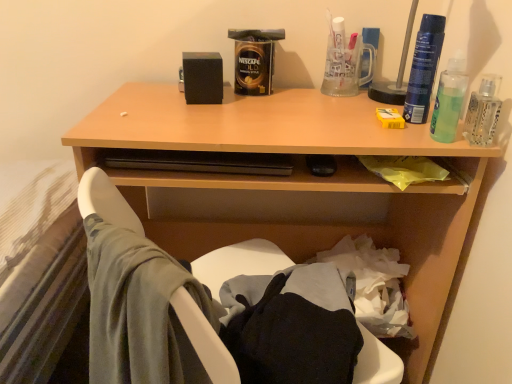
Describe the element at coordinates (292, 183) in the screenshot. I see `wooden desk at upper center` at that location.

This screenshot has width=512, height=384. What do you see at coordinates (449, 100) in the screenshot?
I see `green translucent liquid at upper right` at bounding box center [449, 100].

You are a GUI agent. You are given a task and a screenshot of the screen. Output one action in this format:
    pyautogui.click(x=<x>, y=<y>)
    Task: Click on the blue plastic spray can at upper right, acting as the second bottle starting from the right
    Image resolution: width=512 pixels, height=384 pixels.
    Given the screenshot: What is the action you would take?
    pyautogui.click(x=424, y=68)

I want to click on clear glass bottle at upper right, which appears as the 2th bottle when viewed from the left, so click(483, 112).

Locate an element on the screen. This screenshot has height=384, width=512. wooden desk at upper center is located at coordinates (292, 183).

Is clear glass bottle at upper right, which appears as the 2th bottle when viewed from the left, not inside wooden desk at upper center?

Indeed, clear glass bottle at upper right, which appears as the 2th bottle when viewed from the left, is completely outside wooden desk at upper center.

From a real-world perspective, which is physically above, clear glass bottle at upper right, which appears as the 2th bottle when viewed from the left, or wooden desk at upper center?

clear glass bottle at upper right, which appears as the 2th bottle when viewed from the left.

Considering the sizes of objects clear glass bottle at upper right, which appears as the 2th bottle when viewed from the left, and wooden desk at upper center in the image provided, who is smaller, clear glass bottle at upper right, which appears as the 2th bottle when viewed from the left, or wooden desk at upper center?

With smaller size is clear glass bottle at upper right, which appears as the 2th bottle when viewed from the left.

Between clear glass bottle at upper right, which appears as the 2th bottle when viewed from the left, and wooden desk at upper center, which one appears on the left side from the viewer's perspective?

wooden desk at upper center is more to the left.

Is the surface of clear glass bottle at upper right, which appears as the 2th bottle when viewed from the left, in direct contact with green translucent liquid at upper right?

Yes, clear glass bottle at upper right, which appears as the 2th bottle when viewed from the left, is with green translucent liquid at upper right.

Between clear glass bottle at upper right, which appears as the 2th bottle when viewed from the left, and green translucent liquid at upper right, which one has smaller size?

clear glass bottle at upper right, which appears as the 2th bottle when viewed from the left.

Is clear glass bottle at upper right, the first bottle in the right-to-left sequence, wider than green translucent liquid at upper right?

In fact, clear glass bottle at upper right, the first bottle in the right-to-left sequence, might be narrower than green translucent liquid at upper right.

Considering the relative sizes of clear glass bottle at upper right, the first bottle in the right-to-left sequence, and green translucent liquid at upper right in the image provided, is clear glass bottle at upper right, the first bottle in the right-to-left sequence, taller than green translucent liquid at upper right?

→ In fact, clear glass bottle at upper right, the first bottle in the right-to-left sequence, may be shorter than green translucent liquid at upper right.

Where is `desk on the left of green translucent liquid at upper right`? desk on the left of green translucent liquid at upper right is located at coordinates (292, 183).

Do you think wooden desk at upper center is within green translucent liquid at upper right, or outside of it?

The correct answer is: outside.

How different are the orientations of wooden desk at upper center and green translucent liquid at upper right in degrees?

They differ by 11.3 degrees in their facing directions.

Is wooden desk at upper center directly adjacent to green translucent liquid at upper right?

No.

Is point (449, 90) behind point (128, 191)?

No.

Looking at this image, would you say green translucent liquid at upper right contains wooden desk at upper center?

That's incorrect, wooden desk at upper center is not inside green translucent liquid at upper right.

Who is bigger, green translucent liquid at upper right or wooden desk at upper center?

With larger size is wooden desk at upper center.

Is wooden desk at upper center behind blue plastic spray can at upper right, acting as the second bottle starting from the right?

No.

Which object is thinner, wooden desk at upper center or blue plastic spray can at upper right, acting as the second bottle starting from the right?

With smaller width is blue plastic spray can at upper right, acting as the second bottle starting from the right.

Is wooden desk at upper center shorter than blue plastic spray can at upper right, acting as the second bottle starting from the right?

No.

Which of these two, green translucent liquid at upper right or blue plastic spray can at upper right, the 1th bottle viewed from the left, is smaller?

Smaller between the two is blue plastic spray can at upper right, the 1th bottle viewed from the left.

Can you tell me how much green translucent liquid at upper right and blue plastic spray can at upper right, acting as the second bottle starting from the right, differ in facing direction?

0.00112 degrees separate the facing orientations of green translucent liquid at upper right and blue plastic spray can at upper right, acting as the second bottle starting from the right.

Is the surface of green translucent liquid at upper right in direct contact with blue plastic spray can at upper right, the 1th bottle viewed from the left?

Indeed, green translucent liquid at upper right and blue plastic spray can at upper right, the 1th bottle viewed from the left, are beside each other and touching.

Is point (451, 81) positioned before point (420, 54)?

Yes, point (451, 81) is closer to viewer.

Between blue plastic spray can at upper right, the 1th bottle viewed from the left, and green translucent liquid at upper right, which one appears on the right side from the viewer's perspective?

Positioned to the right is green translucent liquid at upper right.

What's the angular difference between blue plastic spray can at upper right, acting as the second bottle starting from the right, and green translucent liquid at upper right's facing directions?

The angle between the facing direction of blue plastic spray can at upper right, acting as the second bottle starting from the right, and the facing direction of green translucent liquid at upper right is 0.00112 degrees.

Could you tell me if blue plastic spray can at upper right, acting as the second bottle starting from the right, is turned towards green translucent liquid at upper right?

Yes, blue plastic spray can at upper right, acting as the second bottle starting from the right, is aimed at green translucent liquid at upper right.

Which object is more forward, blue plastic spray can at upper right, acting as the second bottle starting from the right, or green translucent liquid at upper right?

green translucent liquid at upper right is more forward.

Image resolution: width=512 pixels, height=384 pixels. I want to click on the 1st bottle directly above the wooden desk at upper center (from a real-world perspective), so click(483, 112).

This screenshot has width=512, height=384. What are the coordinates of `mouthwash that is above the clear glass bottle at upper right, the first bottle in the right-to-left sequence (from the image's perspective)` in the screenshot? It's located at (449, 100).

When comparing their distances from blue plastic spray can at upper right, acting as the second bottle starting from the right, does clear glass bottle at upper right, the first bottle in the right-to-left sequence, or wooden desk at upper center seem closer?

clear glass bottle at upper right, the first bottle in the right-to-left sequence, lies closer to blue plastic spray can at upper right, acting as the second bottle starting from the right, than the other object.

From the image, which object appears to be nearer to blue plastic spray can at upper right, the 1th bottle viewed from the left, clear glass bottle at upper right, which appears as the 2th bottle when viewed from the left, or green translucent liquid at upper right?

green translucent liquid at upper right lies closer to blue plastic spray can at upper right, the 1th bottle viewed from the left, than the other object.

Estimate the real-world distances between objects in this image. Which object is further from green translucent liquid at upper right, wooden desk at upper center or blue plastic spray can at upper right, the 1th bottle viewed from the left?

wooden desk at upper center lies further to green translucent liquid at upper right than the other object.

Considering their positions, is green translucent liquid at upper right positioned closer to blue plastic spray can at upper right, acting as the second bottle starting from the right, than wooden desk at upper center?

Based on the image, green translucent liquid at upper right appears to be nearer to blue plastic spray can at upper right, acting as the second bottle starting from the right.

Based on their spatial positions, is blue plastic spray can at upper right, acting as the second bottle starting from the right, or wooden desk at upper center closer to clear glass bottle at upper right, which appears as the 2th bottle when viewed from the left?

blue plastic spray can at upper right, acting as the second bottle starting from the right, is closer to clear glass bottle at upper right, which appears as the 2th bottle when viewed from the left.

Estimate the real-world distances between objects in this image. Which object is further from clear glass bottle at upper right, the first bottle in the right-to-left sequence, green translucent liquid at upper right or blue plastic spray can at upper right, the 1th bottle viewed from the left?

blue plastic spray can at upper right, the 1th bottle viewed from the left.

From the image, which object appears to be nearer to blue plastic spray can at upper right, acting as the second bottle starting from the right, wooden desk at upper center or clear glass bottle at upper right, the first bottle in the right-to-left sequence?

clear glass bottle at upper right, the first bottle in the right-to-left sequence, is positioned closer to the anchor blue plastic spray can at upper right, acting as the second bottle starting from the right.

In the scene shown: Considering their positions, is green translucent liquid at upper right positioned closer to blue plastic spray can at upper right, the 1th bottle viewed from the left, than clear glass bottle at upper right, the first bottle in the right-to-left sequence?

green translucent liquid at upper right is positioned closer to the anchor blue plastic spray can at upper right, the 1th bottle viewed from the left.

Where is `mouthwash between blue plastic spray can at upper right, acting as the second bottle starting from the right, and clear glass bottle at upper right, which appears as the 2th bottle when viewed from the left, in the vertical direction`? This screenshot has height=384, width=512. mouthwash between blue plastic spray can at upper right, acting as the second bottle starting from the right, and clear glass bottle at upper right, which appears as the 2th bottle when viewed from the left, in the vertical direction is located at coordinates (449, 100).

Find the location of a particular element. This screenshot has height=384, width=512. bottle between blue plastic spray can at upper right, the 1th bottle viewed from the left, and wooden desk at upper center, in the vertical direction is located at coordinates (483, 112).

You are a GUI agent. You are given a task and a screenshot of the screen. Output one action in this format:
    pyautogui.click(x=<x>, y=<y>)
    Task: Click on the mouthwash between wooden desk at upper center and clear glass bottle at upper right, which appears as the 2th bottle when viewed from the left, from left to right
    The height and width of the screenshot is (384, 512).
    Given the screenshot: What is the action you would take?
    pyautogui.click(x=449, y=100)

Where is `mouthwash between blue plastic spray can at upper right, acting as the second bottle starting from the right, and wooden desk at upper center from top to bottom`? mouthwash between blue plastic spray can at upper right, acting as the second bottle starting from the right, and wooden desk at upper center from top to bottom is located at coordinates (449, 100).